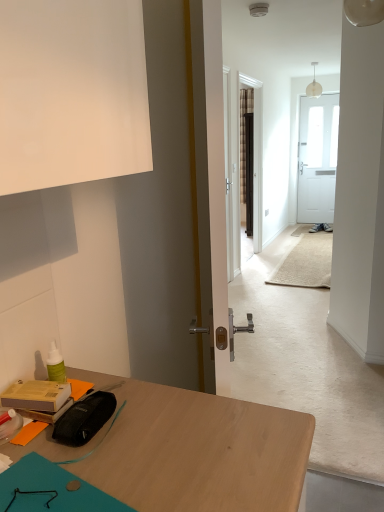
Question: Is translucent glass pendant light at upper center to the right of matte black pouch at lower left, the 1th stationery positioned from the right, from the viewer's perspective?

Choices:
 (A) no
 (B) yes

Answer: (B)

Question: Is there a large distance between translucent glass pendant light at upper center and matte black pouch at lower left, the 2th stationery when ordered from left to right?

Choices:
 (A) no
 (B) yes

Answer: (B)

Question: Is translucent glass pendant light at upper center in front of matte black pouch at lower left, the 1th stationery positioned from the right?

Choices:
 (A) no
 (B) yes

Answer: (A)

Question: Is matte black pouch at lower left, the 1th stationery positioned from the right, surrounded by translucent glass pendant light at upper center?

Choices:
 (A) yes
 (B) no

Answer: (B)

Question: From the image's perspective, is translucent glass pendant light at upper center beneath matte black pouch at lower left, the 1th stationery positioned from the right?

Choices:
 (A) no
 (B) yes

Answer: (A)

Question: From the image's perspective, is translucent glass pendant light at upper center located above matte black pouch at lower left, the 2th stationery when ordered from left to right?

Choices:
 (A) yes
 (B) no

Answer: (A)

Question: From a real-world perspective, is matte black pouch at lower left, the 1th stationery positioned from the right, physically above translucent glass pendant light at upper center?

Choices:
 (A) no
 (B) yes

Answer: (A)

Question: Is matte black pouch at lower left, the 2th stationery when ordered from left to right, bigger than translucent glass pendant light at upper center?

Choices:
 (A) yes
 (B) no

Answer: (B)

Question: Can you confirm if matte black pouch at lower left, the 2th stationery when ordered from left to right, is positioned to the right of translucent glass pendant light at upper center?

Choices:
 (A) no
 (B) yes

Answer: (A)

Question: Is matte black pouch at lower left, the 2th stationery when ordered from left to right, with translucent glass pendant light at upper center?

Choices:
 (A) no
 (B) yes

Answer: (A)

Question: Could translucent glass pendant light at upper center be considered to be inside matte black pouch at lower left, the 2th stationery when ordered from left to right?

Choices:
 (A) no
 (B) yes

Answer: (A)

Question: Is matte black pouch at lower left, the 2th stationery when ordered from left to right, in front of translucent glass pendant light at upper center?

Choices:
 (A) no
 (B) yes

Answer: (B)

Question: Is matte cardboard box at lower left, acting as the 2th stationery starting from the right, further to camera compared to translucent glass pendant light at upper center?

Choices:
 (A) no
 (B) yes

Answer: (A)